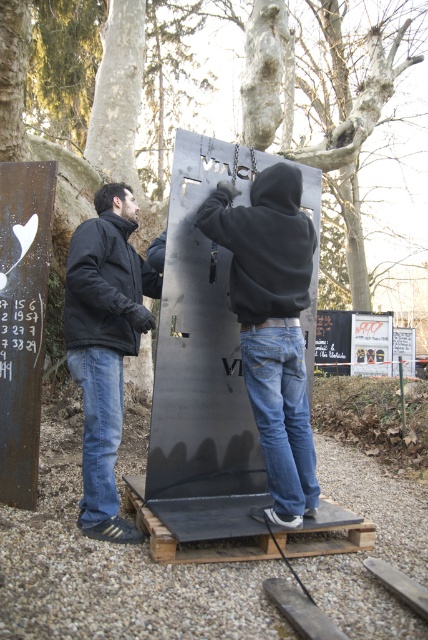
Question: Which of these objects is positioned closest to the smooth bark tree at upper center?

Choices:
 (A) black matte sweatshirt at left
 (B) matte black hoodie at center

Answer: (A)

Question: Is matte black hoodie at center above black matte sweatshirt at center?

Choices:
 (A) yes
 (B) no

Answer: (B)

Question: Which object is farther from the camera taking this photo?

Choices:
 (A) black metal sign at left
 (B) smooth bark tree at upper center
 (C) matte black hoodie at center

Answer: (B)

Question: Which of the following is the closest to the observer?

Choices:
 (A) (2, 48)
 (B) (110, 346)

Answer: (B)

Question: Is black matte sweatshirt at center to the left of black matte sweatshirt at left from the viewer's perspective?

Choices:
 (A) yes
 (B) no

Answer: (B)

Question: In this image, where is smooth bark tree at upper center located relative to black matte sweatshirt at center?

Choices:
 (A) below
 (B) above

Answer: (B)